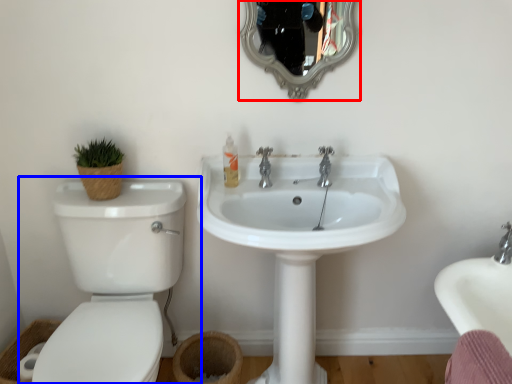
Question: Which object is further to the camera taking this photo, mirror (highlighted by a red box) or toilet (highlighted by a blue box)?

Choices:
 (A) mirror
 (B) toilet

Answer: (A)